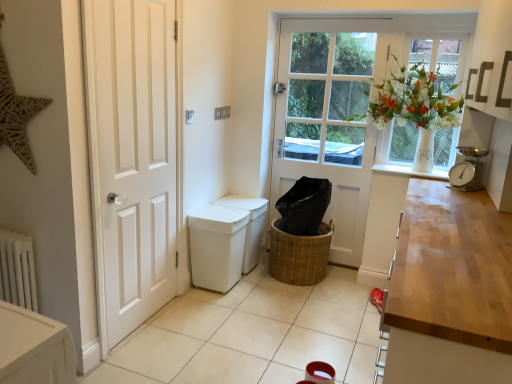
Question: Could you tell me if silver metallic scale at right is turned towards white glossy door at left, which ranks as the 1th door in left-to-right order?

Choices:
 (A) yes
 (B) no

Answer: (B)

Question: From the image's perspective, is silver metallic scale at right located above white glossy door at left, which is counted as the first door, starting from the front?

Choices:
 (A) no
 (B) yes

Answer: (B)

Question: From the image's perspective, is silver metallic scale at right below white glossy door at left, which ranks as the 2th door in back-to-front order?

Choices:
 (A) yes
 (B) no

Answer: (B)

Question: Is silver metallic scale at right at the left side of white glossy door at left, which is counted as the first door, starting from the front?

Choices:
 (A) yes
 (B) no

Answer: (B)

Question: Is silver metallic scale at right behind white glossy door at left, the second door viewed from the right?

Choices:
 (A) yes
 (B) no

Answer: (A)

Question: From a real-world perspective, is silver metallic scale at right above or below white glass window at upper right?

Choices:
 (A) below
 (B) above

Answer: (A)

Question: From their relative heights in the image, would you say silver metallic scale at right is taller or shorter than white glass window at upper right?

Choices:
 (A) tall
 (B) short

Answer: (B)

Question: In the image, is silver metallic scale at right positioned in front of or behind white glass window at upper right?

Choices:
 (A) front
 (B) behind

Answer: (A)

Question: Do you think silver metallic scale at right is within white glass window at upper right, or outside of it?

Choices:
 (A) inside
 (B) outside

Answer: (B)

Question: Do you think white glass window at upper right is within white wooden door at center, the second door viewed from the front, or outside of it?

Choices:
 (A) inside
 (B) outside

Answer: (B)

Question: Looking at the image, does white glass window at upper right seem bigger or smaller compared to white wooden door at center, marked as the first door in a right-to-left arrangement?

Choices:
 (A) small
 (B) big

Answer: (A)

Question: From a real-world perspective, relative to white wooden door at center, the second door viewed from the front, is white glass window at upper right vertically above or below?

Choices:
 (A) above
 (B) below

Answer: (A)

Question: Is point 413,139 positioned closer to the camera than point 344,18?

Choices:
 (A) farther
 (B) closer

Answer: (B)

Question: Is white wooden door at center, arranged as the 1th door when viewed from the back, wider or thinner than white glass window at upper right?

Choices:
 (A) wide
 (B) thin

Answer: (A)

Question: From a real-world perspective, is white wooden door at center, the second door viewed from the front, positioned above or below white glass window at upper right?

Choices:
 (A) above
 (B) below

Answer: (B)